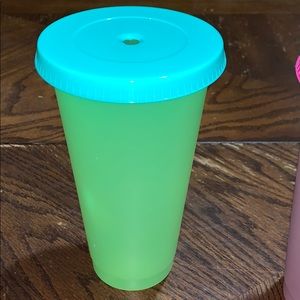
Where is `tupperware`? This screenshot has height=300, width=300. tupperware is located at coordinates (168, 85).